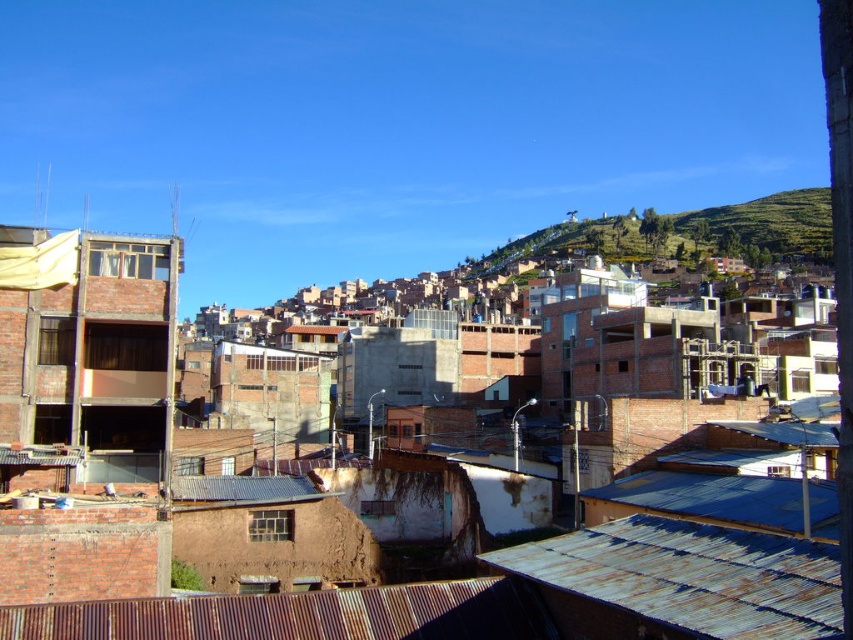
Question: Does rusty corrugated metal roof at lower center have a greater width compared to blue corrugated metal roof at lower right?

Choices:
 (A) no
 (B) yes

Answer: (B)

Question: Does rusty corrugated metal roof at lower center appear over blue corrugated metal roof at lower right?

Choices:
 (A) no
 (B) yes

Answer: (A)

Question: Which object is farther from the camera taking this photo?

Choices:
 (A) rusty corrugated metal roof at lower center
 (B) rusty corrugated metal roof at lower right

Answer: (A)

Question: Which point is closer to the camera taking this photo?

Choices:
 (A) (294, 609)
 (B) (744, 621)
 (C) (730, 236)

Answer: (B)

Question: Which of the following is the farthest from the observer?

Choices:
 (A) (700, 595)
 (B) (695, 474)
 (C) (352, 618)

Answer: (B)

Question: Can you confirm if rusty corrugated metal roof at lower center is thinner than green grassy hillside at upper center?

Choices:
 (A) yes
 (B) no

Answer: (A)